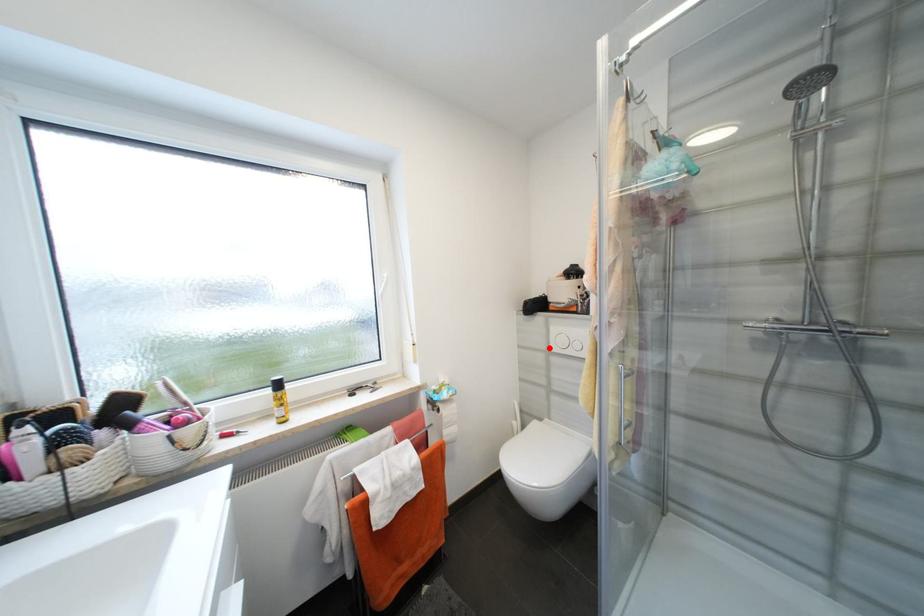
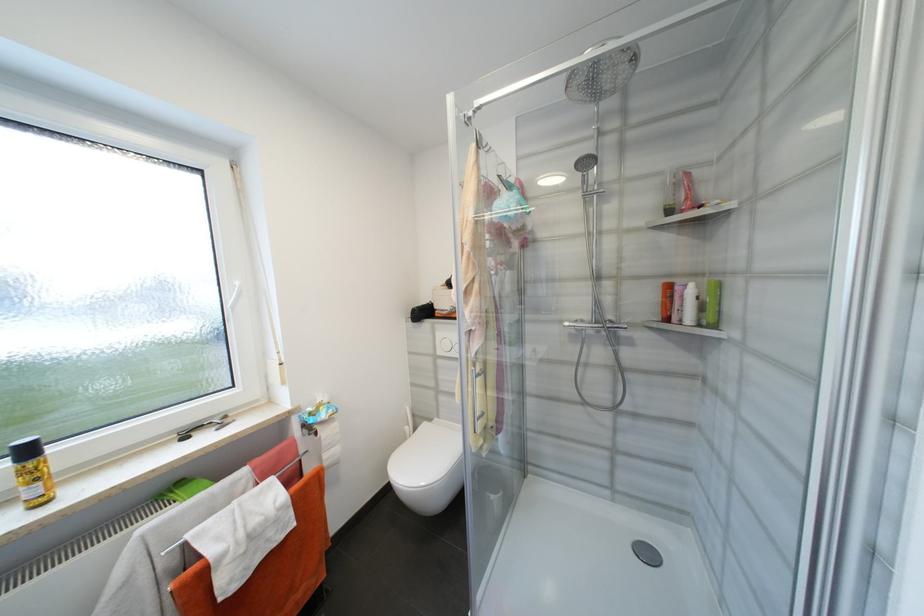
Question: I am providing you with two images of the same scene from different viewpoints. Given a red point in image1, look at the same physical point in image2. Is it:

Choices:
 (A) Closer to the viewpoint
 (B) Farther from the viewpoint

Answer: (B)